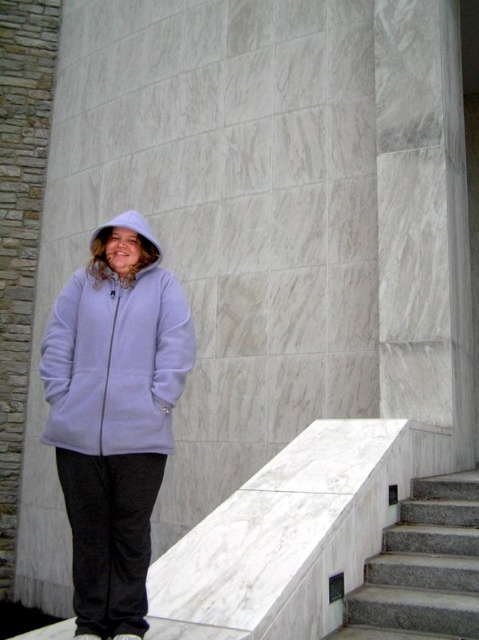
You are taking a photo of the marble structure and want to focus on the point at coordinates point (116,400) and point (157,253). Which point should you focus on first to ensure both are in sharp focus?

You should focus on point (116,400) first because it is closer to the camera and will ensure both points are within the depth of field.

You are planning to take a photo of the lavender fleece jacket at center and the white fleece hood at upper left. To ensure both are fully visible in the frame, which object requires you to adjust the camera angle to accommodate its width?

The lavender fleece jacket at center requires adjusting the camera angle because it is wider than the white fleece hood at upper left.

From the picture: You are a photographer trying to capture the person in the image. The camera you are using has a focus point at coordinate point (114, 416). Will the purple fleece jacket at center be in focus?

The purple fleece jacket at center is located at point (114, 416), so yes, the purple fleece jacket at center will be in focus because it is exactly at the focus point.